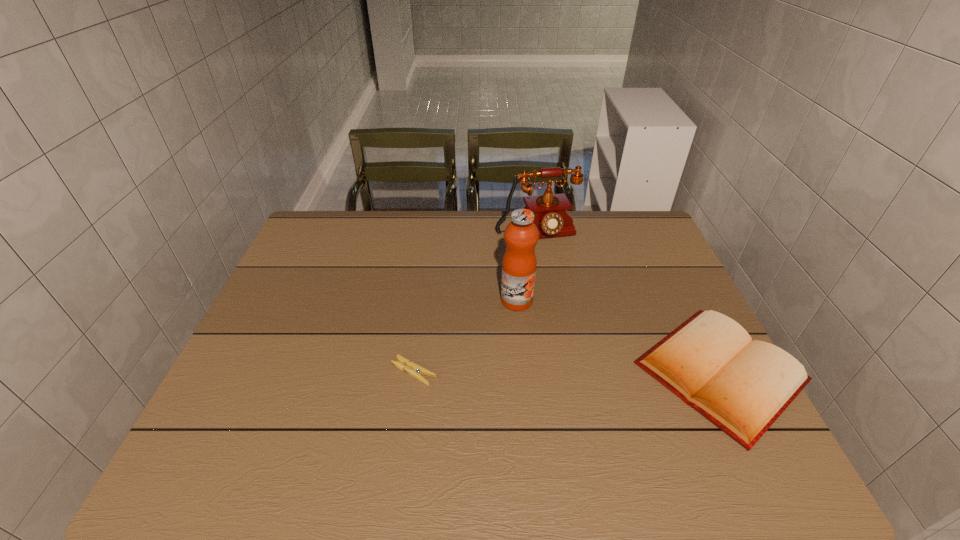
In order to click on vacant space at the far edge of the desktop in this screenshot , I will do `click(492, 214)`.

This screenshot has height=540, width=960. I want to click on vacant region at the near edge of the desktop, so click(327, 416).

Locate an element on the screen. This screenshot has height=540, width=960. free space at the left edge is located at coordinates (300, 372).

This screenshot has width=960, height=540. Identify the location of vacant space at the right edge. (626, 278).

This screenshot has width=960, height=540. Find the location of `free region at the far left corner of the desktop`. free region at the far left corner of the desktop is located at coordinates (337, 244).

Find the location of a particular element. The height and width of the screenshot is (540, 960). vacant space at the far right corner is located at coordinates (616, 215).

You are a GUI agent. You are given a task and a screenshot of the screen. Output one action in this format:
    pyautogui.click(x=<x>, y=<y>)
    Task: Click on the vacant space that's between the third nearest object and the clothespin
    The width and height of the screenshot is (960, 540).
    Given the screenshot: What is the action you would take?
    pyautogui.click(x=466, y=336)

Find the location of a particular element. The height and width of the screenshot is (540, 960). empty space between the telephone and the leftmost object is located at coordinates (475, 302).

At what (x,y) coordinates should I click in order to perform the action: click on vacant area that lies between the farthest object and the rightmost object. Please return your answer as a coordinate pair (x, y). Image resolution: width=960 pixels, height=540 pixels. Looking at the image, I should click on tap(628, 303).

Find the location of a particular element. This screenshot has height=540, width=960. empty space that is in between the third tallest object and the tallest object is located at coordinates (618, 336).